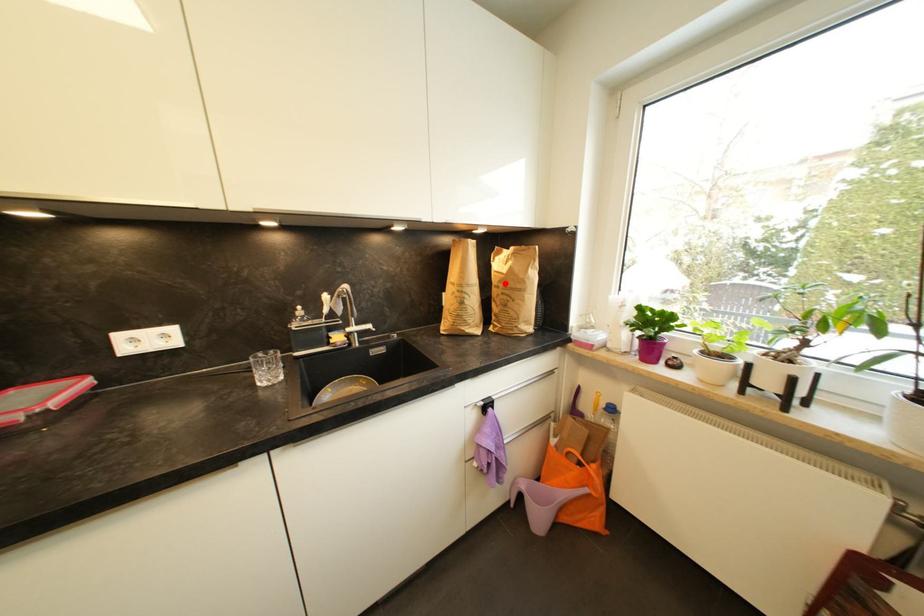
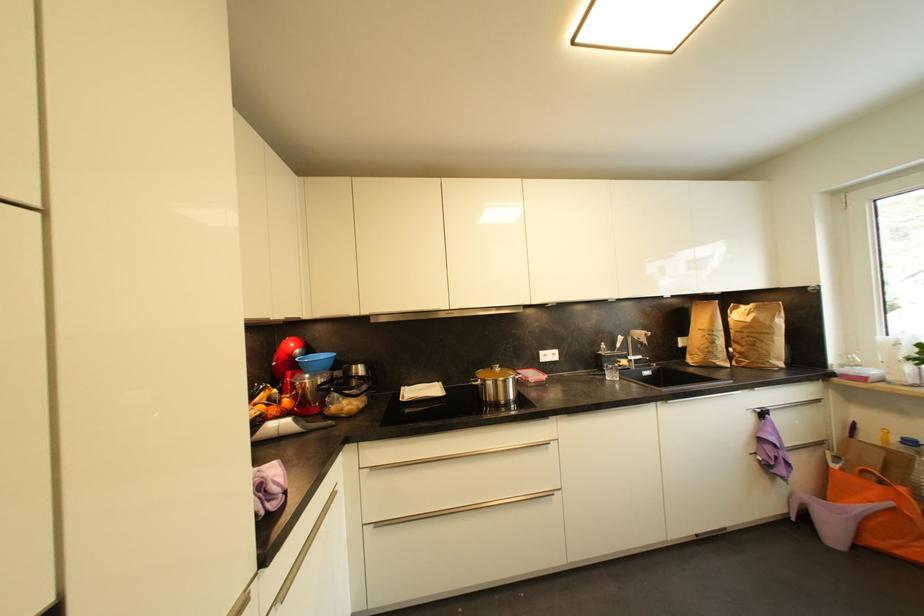
Where in the second image is the point corresponding to the highlighted location from the first image?

(748, 330)